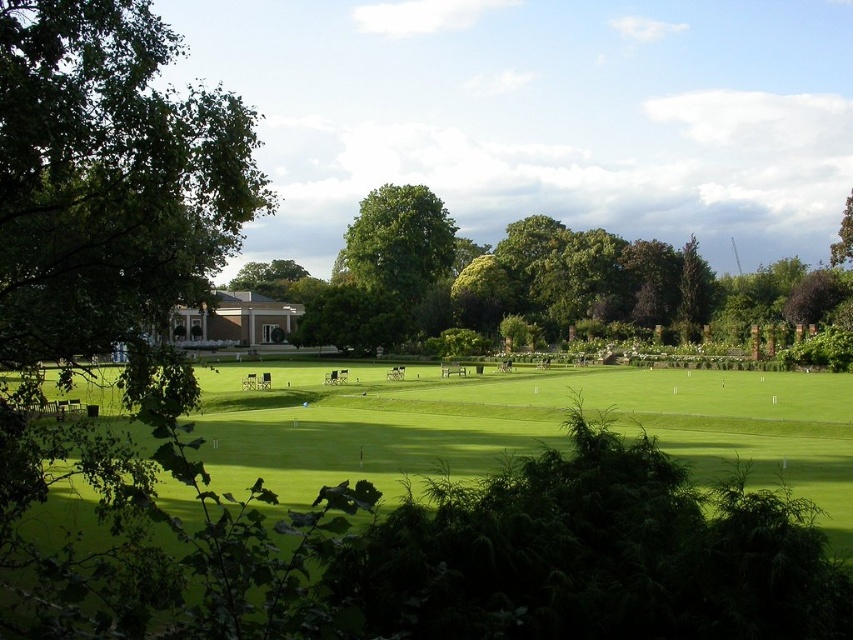
Between green grassy field at center and green leafy tree at center, which one has less height?

green grassy field at center is shorter.

Is green grassy field at center to the right of green leafy tree at center from the viewer's perspective?

Yes, green grassy field at center is to the right of green leafy tree at center.

Does point (292, 369) lie in front of point (395, 333)?

That is True.

At what (x,y) coordinates should I click in order to perform the action: click on green grassy field at center. Please return your answer as a coordinate pair (x, y). Looking at the image, I should click on (526, 426).

Is green grassy field at center wider than green leafy tree at upper right?

Yes.

Can you confirm if green grassy field at center is bigger than green leafy tree at upper right?

No, green grassy field at center is not bigger than green leafy tree at upper right.

Find the location of a particular element. The height and width of the screenshot is (640, 853). green grassy field at center is located at coordinates (526, 426).

Where is `green grassy field at center`? green grassy field at center is located at coordinates (526, 426).

Which is below, green leafy tree at center or green leafy tree at upper right?

green leafy tree at center is lower down.

Who is more forward, (508, 262) or (839, 234)?

Point (839, 234) is more forward.

Locate an element on the screen. green leafy tree at center is located at coordinates (611, 285).